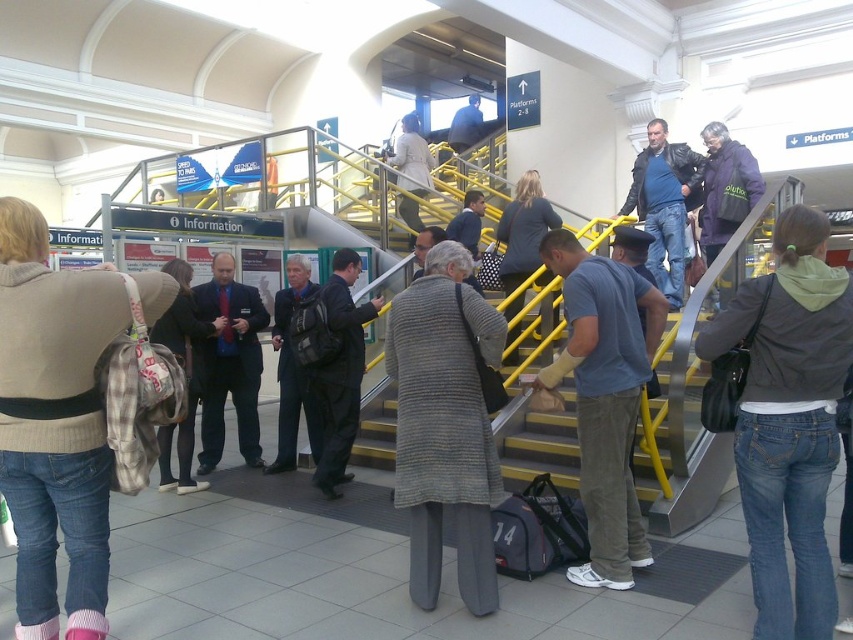
Question: Which of the following is the closest to the observer?

Choices:
 (A) (73, 429)
 (B) (177, 312)

Answer: (A)

Question: Which object is positioned closest to the dark gray jacket at center?

Choices:
 (A) blue cotton t-shirt at center
 (B) dark blue suit at center

Answer: (B)

Question: Is dark gray wool coat at center thinner than light beige coat at upper center?

Choices:
 (A) no
 (B) yes

Answer: (B)

Question: Among these objects, which one is nearest to the camera?

Choices:
 (A) leather jacket at upper right
 (B) purple soft jacket at upper right

Answer: (B)

Question: Can you confirm if dark blue suit at center is positioned above dark gray jacket at center?

Choices:
 (A) no
 (B) yes

Answer: (B)

Question: Does gray wool coat at center have a larger size compared to dark gray wool coat at center?

Choices:
 (A) no
 (B) yes

Answer: (A)